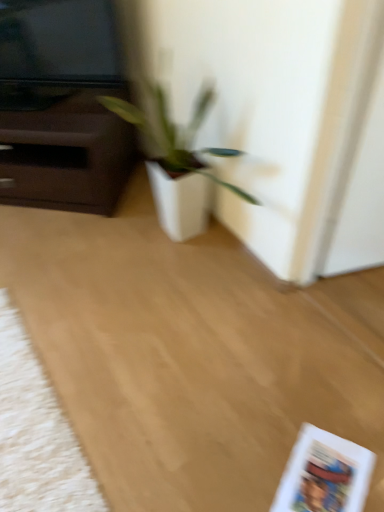
I want to click on vacant area that lies between white matte pot at center and white matte paperback book at lower right, so click(248, 382).